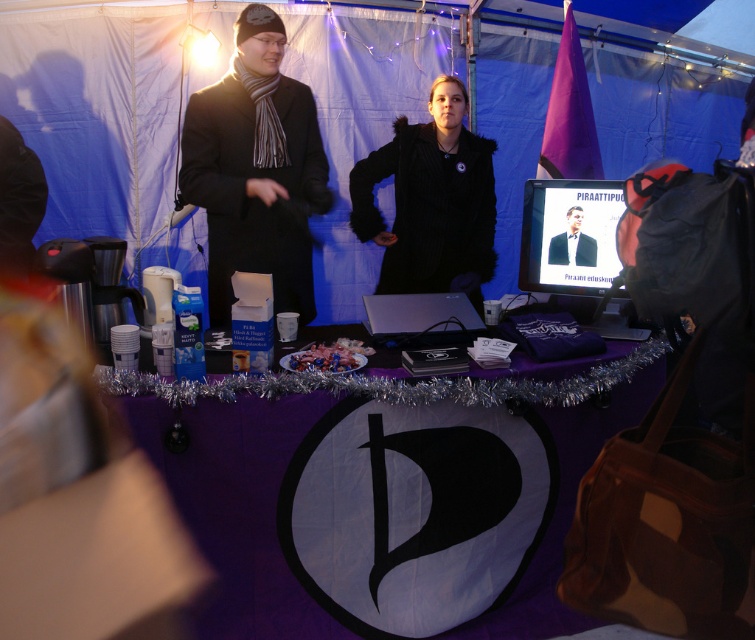
Question: Does black woolen coat at center appear on the right side of matte black suit at center?

Choices:
 (A) no
 (B) yes

Answer: (A)

Question: Which is nearer to the black fur coat at center?

Choices:
 (A) matte black monitor at upper right
 (B) black woolen coat at center

Answer: (A)

Question: Is black fur coat at center wider than matte black suit at center?

Choices:
 (A) yes
 (B) no

Answer: (A)

Question: Which point appears farthest from the camera in this image?

Choices:
 (A) (490, 582)
 (B) (421, 140)

Answer: (B)

Question: Which object is closer to the camera taking this photo?

Choices:
 (A) purple fabric table at center
 (B) matte black monitor at upper right
 (C) matte black suit at center
 (D) satin silver laptop at center

Answer: (A)

Question: Can you confirm if black woolen coat at center is smaller than matte black suit at center?

Choices:
 (A) no
 (B) yes

Answer: (A)